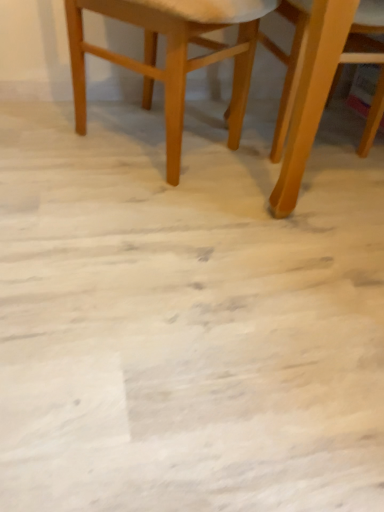
Locate an element on the screen. The image size is (384, 512). free space on the front side of wooden chair at center, which ranks as the first chair in left-to-right order is located at coordinates (132, 242).